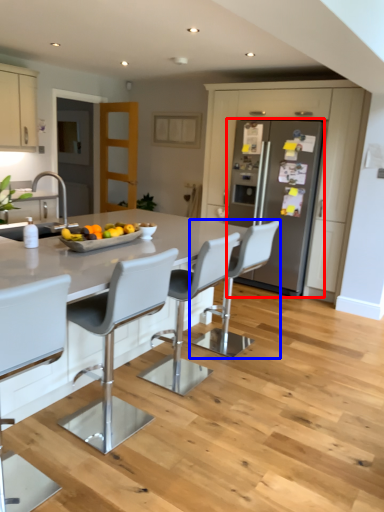
Question: Among these objects, which one is farthest to the camera, refrigerator (highlighted by a red box) or chair (highlighted by a blue box)?

Choices:
 (A) refrigerator
 (B) chair

Answer: (A)